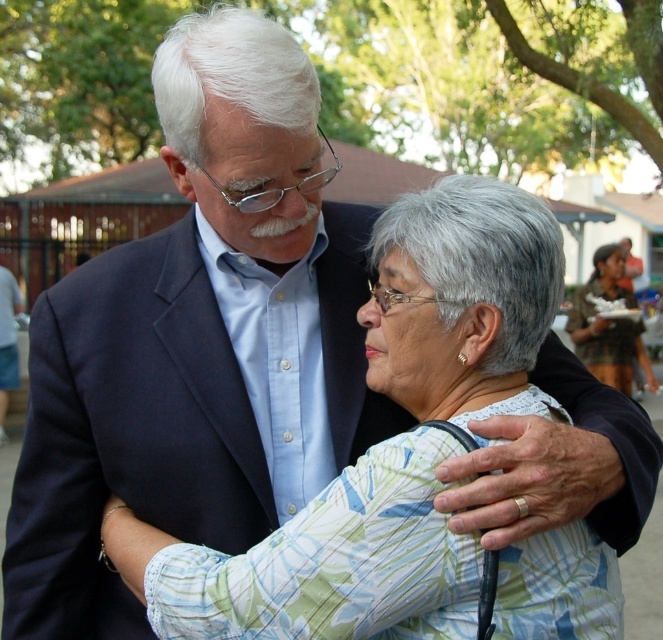
You are a photographer positioned at the center of a park. You see a camouflage fabric shirt at right and a matte blue suit at center. Your camera has a minimum focus distance of 5 meters. Can you focus on both subjects simultaneously without adjusting your position?

The distance between the camouflage fabric shirt at right and the matte blue suit at center is 7.37 meters. Since the camera requires a minimum focus distance of 5 meters, the photographer can focus on both subjects without moving because the distance between them exceeds the minimum requirement.

What is the object located at the coordinates point (x=609, y=324) in the image?

The point (x=609, y=324) marks the camouflage fabric shirt at right.